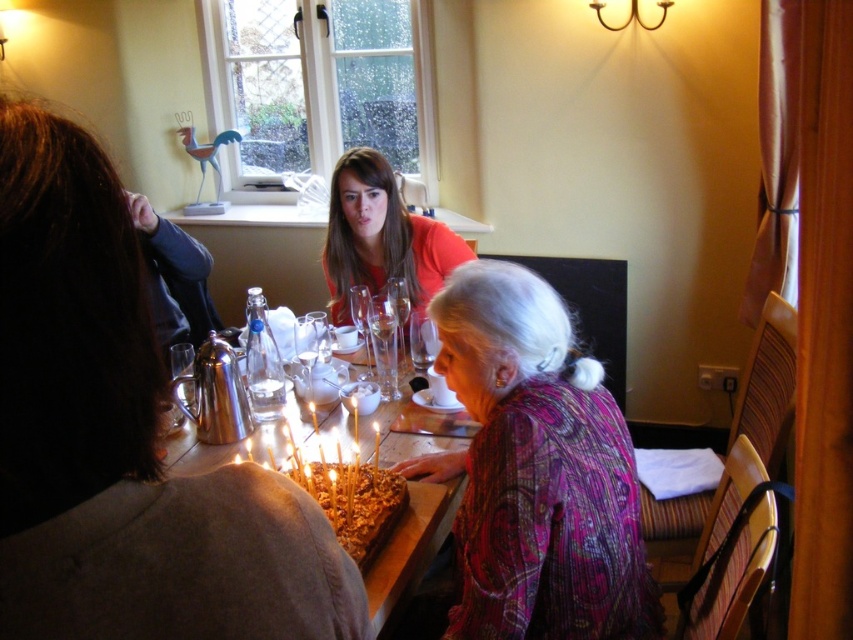
You are a photographer standing in the room and want to take a closeup photo of the patterned fabric blouse at center. The camera you have can focus on objects as close as 1 meter away. Can you take the photo without moving closer?

The patterned fabric blouse at center is 1.17 meters away from the viewer, which is within the camera focus range of 1 meter. Therefore, you can take the photo without moving closer.

You are a photographer trying to capture a group photo of the people at the dining table. You notice two individuals wearing a patterned fabric blouse at center and a matte orange shirt at center. Which person should you ask to move closer to the camera to ensure both are in focus, considering their clothing widths?

You should ask the person wearing the patterned fabric blouse at center to move closer to the camera because it has a smaller width compared to the matte orange shirt at center, ensuring both can be in focus.

You are a photographer setting up for a group photo. You notice the matte orange shirt at center and the clear glass wine glass at center in the scene. Which object is wider when viewed from your camera angle?

The matte orange shirt at center is wider than the clear glass wine glass at center.